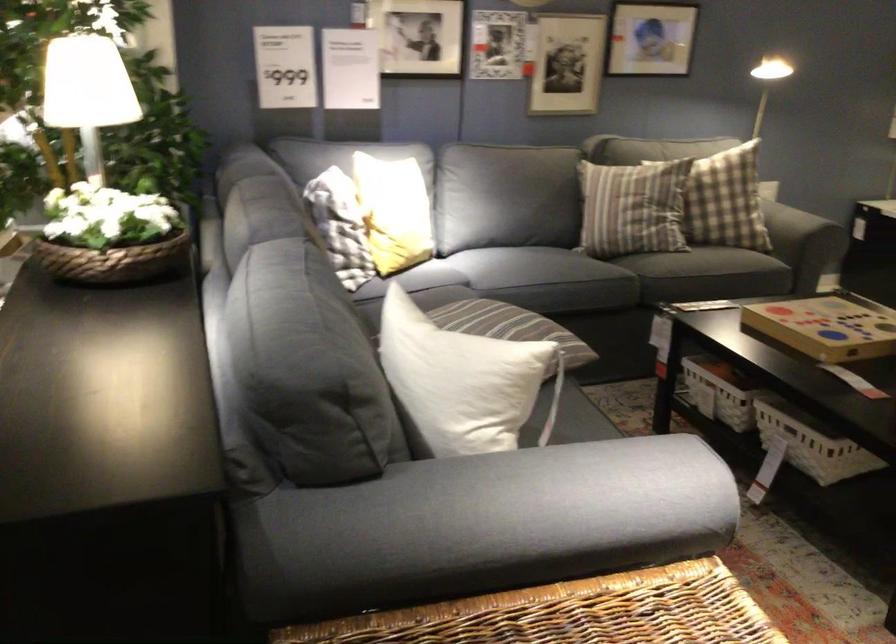
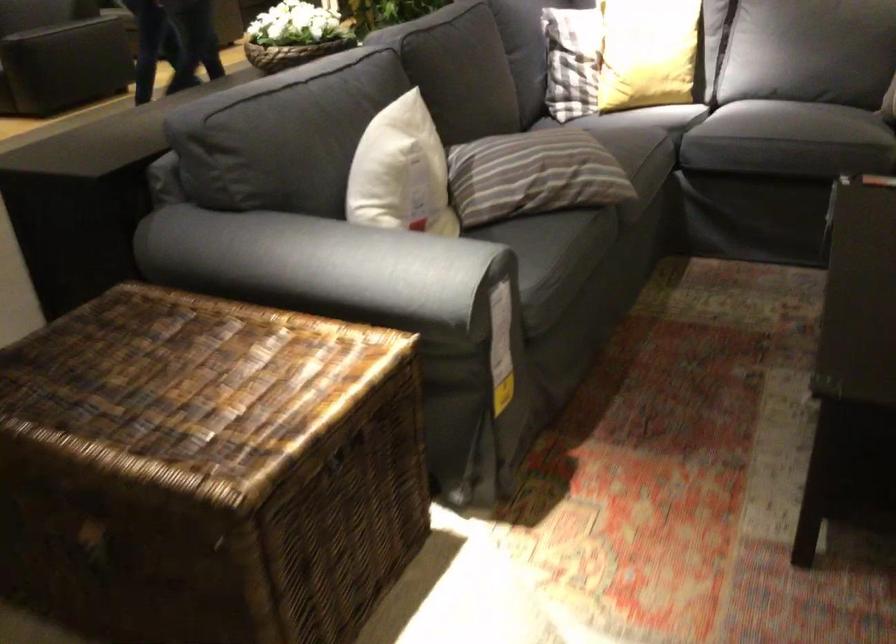
Find the pixel in the second image that matches point 474,486 in the first image.

(304, 265)